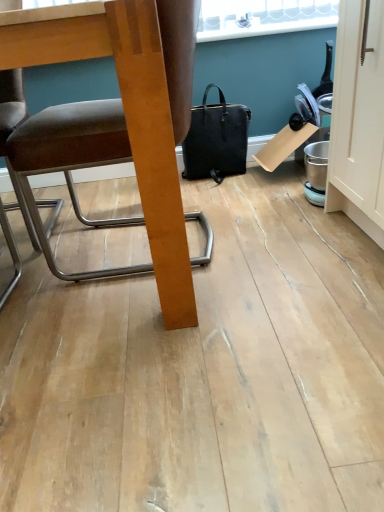
Question: Is black leather handbag at center wider than brown leather chair at left?

Choices:
 (A) no
 (B) yes

Answer: (A)

Question: From the image's perspective, is black leather handbag at center on brown leather chair at left?

Choices:
 (A) yes
 (B) no

Answer: (A)

Question: From the image's perspective, is black leather handbag at center under brown leather chair at left?

Choices:
 (A) yes
 (B) no

Answer: (B)

Question: Is black leather handbag at center far from brown leather chair at left?

Choices:
 (A) yes
 (B) no

Answer: (B)

Question: Is black leather handbag at center to the right of brown leather chair at left from the viewer's perspective?

Choices:
 (A) yes
 (B) no

Answer: (A)

Question: From a real-world perspective, is black leather handbag at center physically above brown leather chair at left?

Choices:
 (A) yes
 (B) no

Answer: (B)

Question: Is brown leather chair at left smaller than black leather handbag at center?

Choices:
 (A) no
 (B) yes

Answer: (A)

Question: Is brown leather chair at left behind black leather handbag at center?

Choices:
 (A) yes
 (B) no

Answer: (B)

Question: Is brown leather chair at left at the left side of black leather handbag at center?

Choices:
 (A) no
 (B) yes

Answer: (B)

Question: Does brown leather chair at left contain black leather handbag at center?

Choices:
 (A) no
 (B) yes

Answer: (A)

Question: Is brown leather chair at left in contact with black leather handbag at center?

Choices:
 (A) no
 (B) yes

Answer: (A)

Question: From the image's perspective, is brown leather chair at left on top of black leather handbag at center?

Choices:
 (A) no
 (B) yes

Answer: (A)

Question: Is black leather handbag at center in front of or behind brown leather chair at left in the image?

Choices:
 (A) front
 (B) behind

Answer: (B)